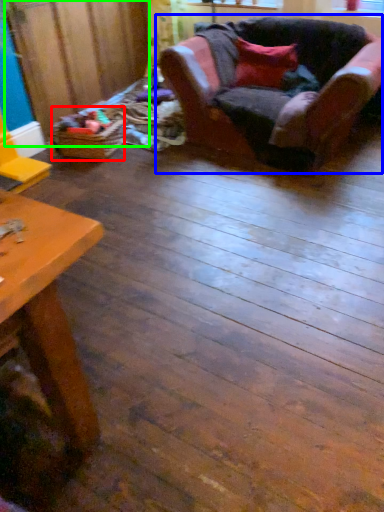
Question: Considering the real-world distances, which object is closest to toy (highlighted by a red box)? chair (highlighted by a blue box) or plywood (highlighted by a green box).

Choices:
 (A) chair
 (B) plywood

Answer: (B)